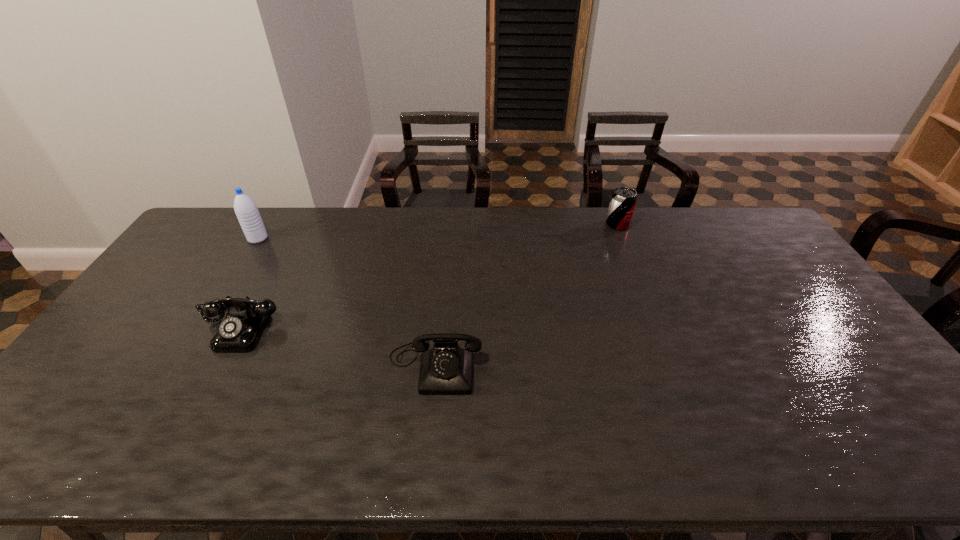
The image size is (960, 540). I want to click on water bottle located in the far edge section of the desktop, so click(x=246, y=210).

Locate an element on the screen. soda can that is at the far edge is located at coordinates (623, 200).

What are the coordinates of `free space at the far edge of the desktop` in the screenshot? It's located at (549, 221).

Locate an element on the screen. Image resolution: width=960 pixels, height=540 pixels. vacant space at the near edge of the desktop is located at coordinates (782, 443).

This screenshot has height=540, width=960. I want to click on vacant space at the far right corner of the desktop, so click(x=753, y=216).

Where is `vacant space in between the third object from left to right and the left telephone`? The image size is (960, 540). vacant space in between the third object from left to right and the left telephone is located at coordinates (338, 347).

Locate an element on the screen. This screenshot has height=540, width=960. blank region between the second object from right to left and the left telephone is located at coordinates (338, 347).

In order to click on vacant region between the third nearest object and the rightmost object in this screenshot , I will do `click(438, 232)`.

Find the location of `empty space that is in between the second object from right to left and the farthest object`. empty space that is in between the second object from right to left and the farthest object is located at coordinates (526, 294).

You are a GUI agent. You are given a task and a screenshot of the screen. Output one action in this format:
    pyautogui.click(x=<x>, y=<y>)
    Task: Click on the empty space between the farthest object and the left telephone
    
    Given the screenshot: What is the action you would take?
    pyautogui.click(x=429, y=276)